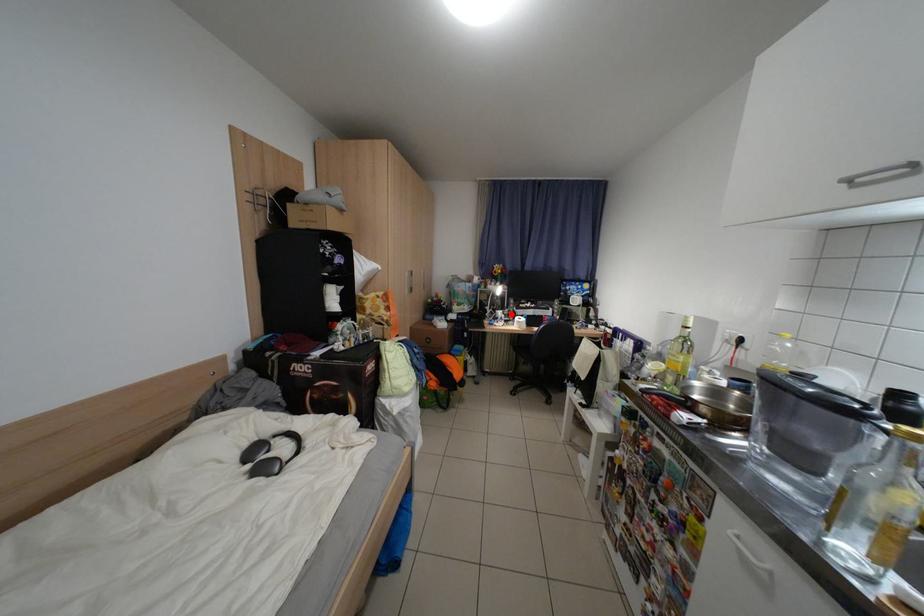
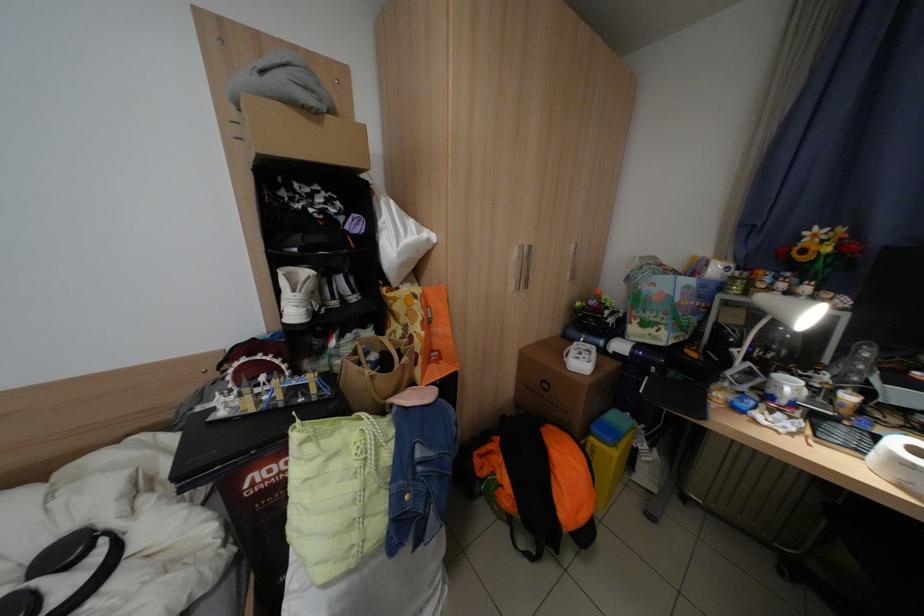
The point at the highlighted location is marked in the first image. Where is the corresponding point in the second image?

(800, 387)